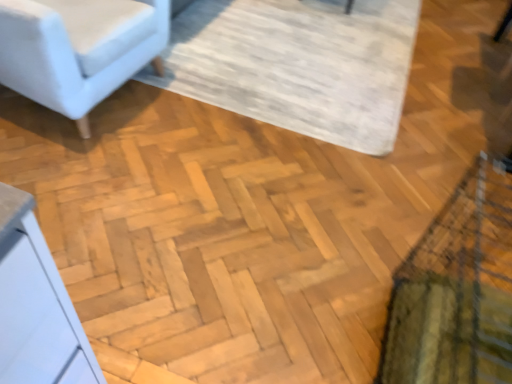
Where is `light gray fabric chair at upper left`? The height and width of the screenshot is (384, 512). light gray fabric chair at upper left is located at coordinates (65, 58).

This screenshot has height=384, width=512. What do you see at coordinates (65, 58) in the screenshot? I see `light gray fabric chair at upper left` at bounding box center [65, 58].

Locate an element on the screen. The height and width of the screenshot is (384, 512). light gray fabric chair at upper left is located at coordinates (65, 58).